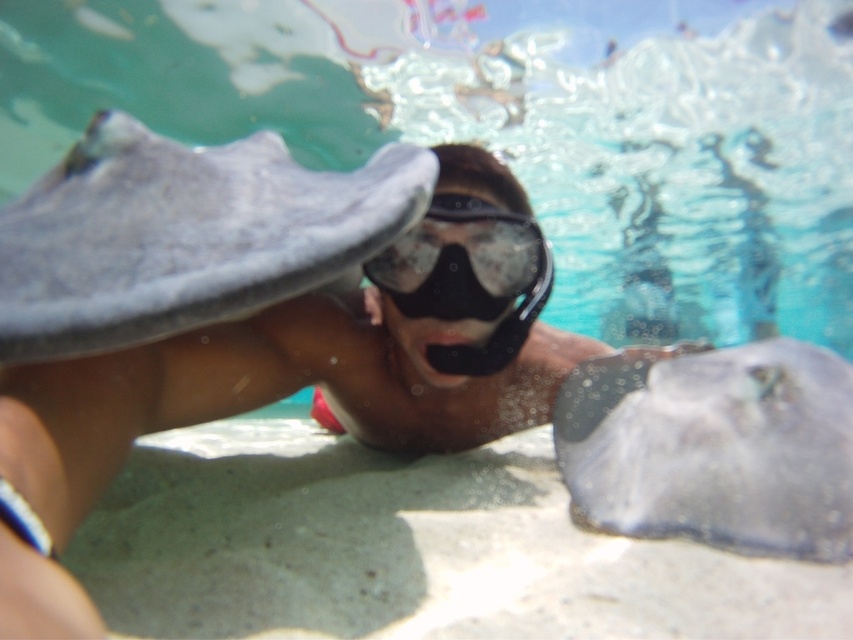
Which is more to the right, gray matte stingray at center or transparent rubber goggles at center?

Positioned to the right is transparent rubber goggles at center.

From the picture: Does gray matte stingray at center appear over transparent rubber goggles at center?

Correct, gray matte stingray at center is located above transparent rubber goggles at center.

At what (x,y) coordinates should I click in order to perform the action: click on gray matte stingray at center. Please return your answer as a coordinate pair (x, y). Looking at the image, I should click on (184, 236).

The image size is (853, 640). What are the coordinates of `gray matte stingray at center` in the screenshot? It's located at (184, 236).

Which is more to the left, matte gray diver at center or translucent rubber stingray at center?

From the viewer's perspective, matte gray diver at center appears more on the left side.

Based on the photo, can you confirm if matte gray diver at center is positioned below translucent rubber stingray at center?

No.

Find the location of a particular element. matte gray diver at center is located at coordinates (297, 376).

What are the coordinates of `matte gray diver at center` in the screenshot? It's located at (297, 376).

Looking at this image, can you confirm if matte gray diver at center is smaller than transparent rubber goggles at center?

Actually, matte gray diver at center might be larger than transparent rubber goggles at center.

Is matte gray diver at center above transparent rubber goggles at center?

Actually, matte gray diver at center is below transparent rubber goggles at center.

Describe the element at coordinates (297, 376) in the screenshot. I see `matte gray diver at center` at that location.

The image size is (853, 640). What are the coordinates of `matte gray diver at center` in the screenshot? It's located at (297, 376).